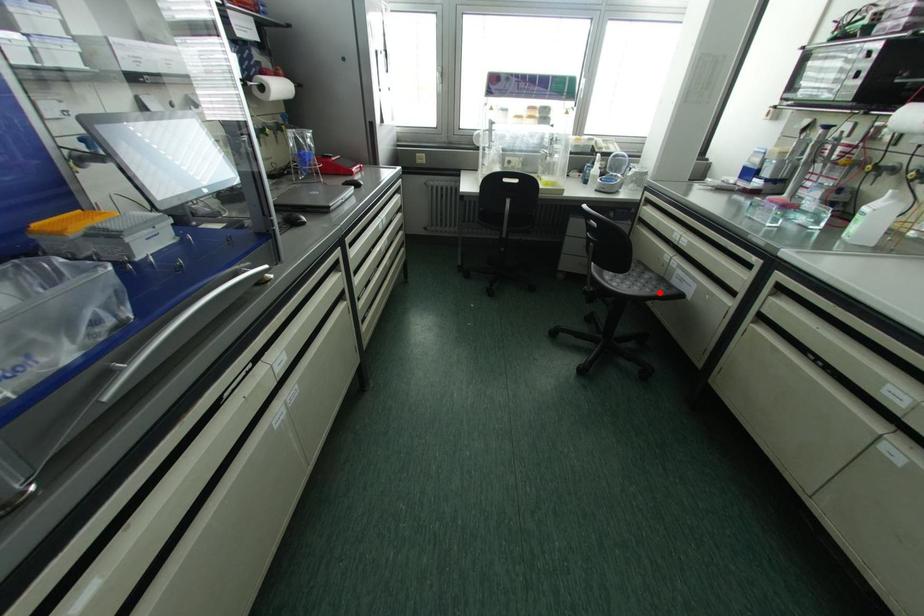
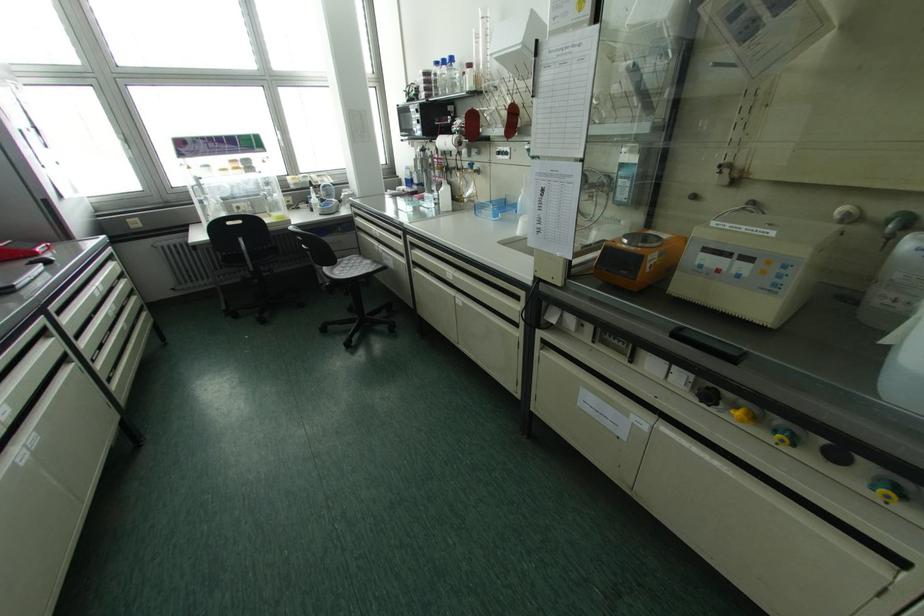
In the second image, find the point that corresponds to the highlighted location in the first image.

(370, 270)